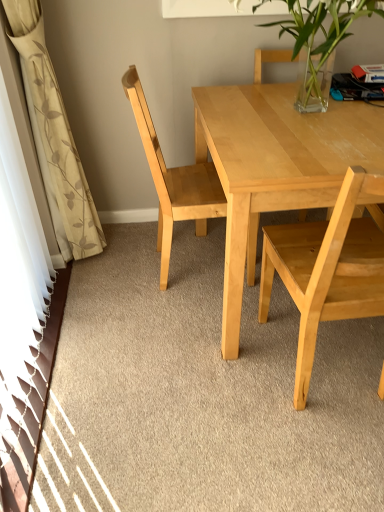
Question: Is clear glass vase at upper center located within white floral fabric curtain at left?

Choices:
 (A) no
 (B) yes

Answer: (A)

Question: Is white floral fabric curtain at left to the right of clear glass vase at upper center from the viewer's perspective?

Choices:
 (A) yes
 (B) no

Answer: (B)

Question: Can you confirm if white floral fabric curtain at left is smaller than clear glass vase at upper center?

Choices:
 (A) yes
 (B) no

Answer: (A)

Question: From the image's perspective, is white floral fabric curtain at left located above clear glass vase at upper center?

Choices:
 (A) no
 (B) yes

Answer: (A)

Question: Can you confirm if white floral fabric curtain at left is positioned to the left of clear glass vase at upper center?

Choices:
 (A) no
 (B) yes

Answer: (B)

Question: In the image, is light wood chair at center, placed as the 2th chair when sorted from right to left, positioned in front of or behind light wood chair at right, marked as the 1th chair in a right-to-left arrangement?

Choices:
 (A) behind
 (B) front

Answer: (A)

Question: From their relative heights in the image, would you say light wood chair at center, the first chair from the left, is taller or shorter than light wood chair at right, which appears as the second chair when viewed from the left?

Choices:
 (A) tall
 (B) short

Answer: (A)

Question: Is point (193, 172) positioned closer to the camera than point (309, 305)?

Choices:
 (A) closer
 (B) farther

Answer: (B)

Question: In the image, is light wood chair at center, placed as the 2th chair when sorted from right to left, on the left side or the right side of light wood chair at right, which appears as the second chair when viewed from the left?

Choices:
 (A) right
 (B) left

Answer: (B)

Question: Would you say light wood chair at center, placed as the 2th chair when sorted from right to left, is to the left or to the right of light wood table at center in the picture?

Choices:
 (A) right
 (B) left

Answer: (B)

Question: Is point (157, 228) closer or farther from the camera than point (276, 136)?

Choices:
 (A) farther
 (B) closer

Answer: (A)

Question: In the image, is light wood chair at center, placed as the 2th chair when sorted from right to left, positioned in front of or behind light wood table at center?

Choices:
 (A) front
 (B) behind

Answer: (B)

Question: Looking at the image, does light wood chair at center, the first chair from the left, seem bigger or smaller compared to light wood table at center?

Choices:
 (A) big
 (B) small

Answer: (B)

Question: Considering the positions of light wood chair at right, marked as the 1th chair in a right-to-left arrangement, and light wood chair at center, placed as the 2th chair when sorted from right to left, in the image, is light wood chair at right, marked as the 1th chair in a right-to-left arrangement, taller or shorter than light wood chair at center, placed as the 2th chair when sorted from right to left,?

Choices:
 (A) tall
 (B) short

Answer: (B)

Question: From a real-world perspective, relative to light wood chair at center, placed as the 2th chair when sorted from right to left, is light wood chair at right, marked as the 1th chair in a right-to-left arrangement, vertically above or below?

Choices:
 (A) above
 (B) below

Answer: (B)